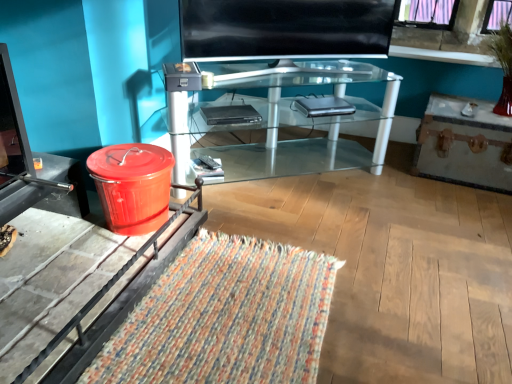
Question: Is clear glass desk at center aimed at silver metallic laptop at center, positioned as the 1th laptop in right-to-left order?

Choices:
 (A) yes
 (B) no

Answer: (A)

Question: From a real-world perspective, is clear glass desk at center under silver metallic laptop at center, positioned as the 1th laptop in right-to-left order?

Choices:
 (A) no
 (B) yes

Answer: (B)

Question: Is clear glass desk at center positioned far away from silver metallic laptop at center, positioned as the 1th laptop in right-to-left order?

Choices:
 (A) no
 (B) yes

Answer: (A)

Question: Is clear glass desk at center at the right side of silver metallic laptop at center, positioned as the 1th laptop in right-to-left order?

Choices:
 (A) yes
 (B) no

Answer: (B)

Question: From the image's perspective, does clear glass desk at center appear lower than silver metallic laptop at center, arranged as the 2th laptop when viewed from the front?

Choices:
 (A) no
 (B) yes

Answer: (B)

Question: Considering the relative sizes of clear glass desk at center and silver metallic laptop at center, arranged as the 1th laptop when viewed from the back, in the image provided, is clear glass desk at center wider than silver metallic laptop at center, arranged as the 1th laptop when viewed from the back,?

Choices:
 (A) no
 (B) yes

Answer: (B)

Question: From the image's perspective, is shiny red vase at upper right located above black plastic dvd player at center, which appears as the first laptop when viewed from the front?

Choices:
 (A) yes
 (B) no

Answer: (A)

Question: From a real-world perspective, does shiny red vase at upper right stand above black plastic dvd player at center, which is the second laptop in back-to-front order?

Choices:
 (A) no
 (B) yes

Answer: (B)

Question: Is shiny red vase at upper right wider than black plastic dvd player at center, positioned as the second laptop in right-to-left order?

Choices:
 (A) yes
 (B) no

Answer: (A)

Question: From a real-world perspective, is shiny red vase at upper right beneath black plastic dvd player at center, which is the second laptop in back-to-front order?

Choices:
 (A) yes
 (B) no

Answer: (B)

Question: Considering the relative sizes of shiny red vase at upper right and black plastic dvd player at center, positioned as the second laptop in right-to-left order, in the image provided, is shiny red vase at upper right thinner than black plastic dvd player at center, positioned as the second laptop in right-to-left order,?

Choices:
 (A) no
 (B) yes

Answer: (A)

Question: Is shiny red vase at upper right not inside black plastic dvd player at center, which appears as the first laptop when viewed from the front?

Choices:
 (A) yes
 (B) no

Answer: (A)

Question: From a real-world perspective, is shiny plastic trash can at lower left positioned under silver metallic laptop at center, arranged as the 2th laptop when viewed from the front, based on gravity?

Choices:
 (A) yes
 (B) no

Answer: (A)